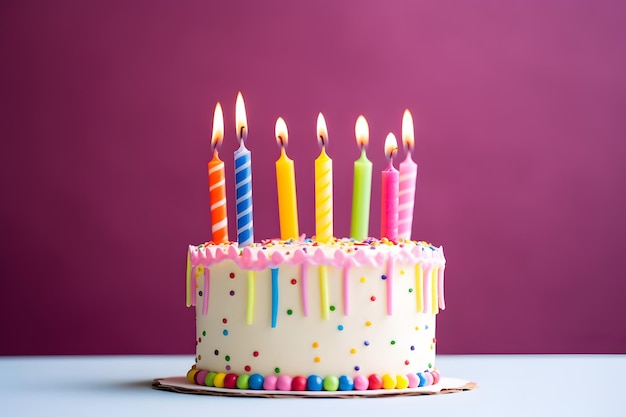
Where is `birthday candles`? birthday candles is located at coordinates (218, 208), (243, 207), (290, 204), (321, 205), (361, 207), (389, 210), (406, 206).